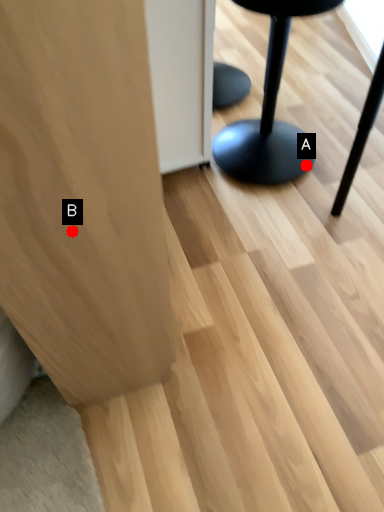
Question: Two points are circled on the image, labeled by A and B beside each circle. Which point is farther from the camera taking this photo?

Choices:
 (A) A is further
 (B) B is further

Answer: (A)